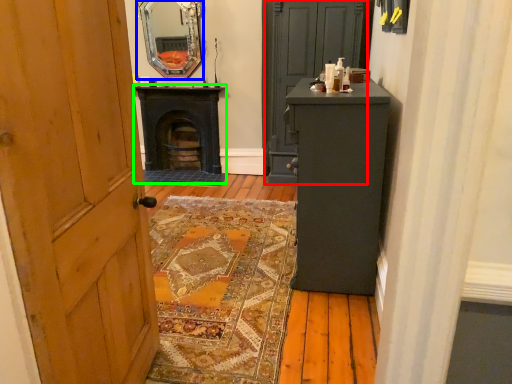
Question: Which object is the farthest from door (highlighted by a red box)? Choose among these: mirror (highlighted by a blue box) or stove (highlighted by a green box).

Choices:
 (A) mirror
 (B) stove

Answer: (A)